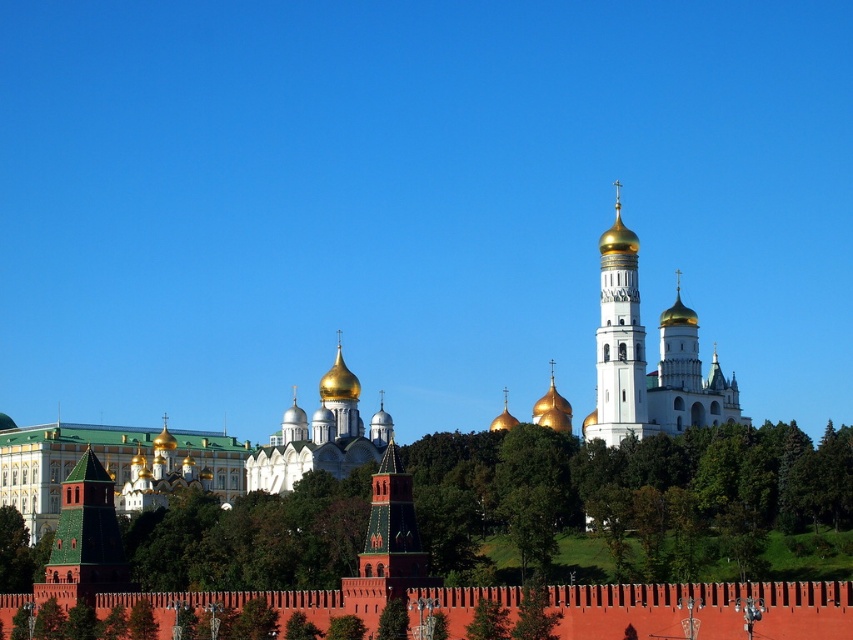
You are standing at the center of the Kremlin and want to take a photo of the green tiled tower at lower left. Which direction should you face to ensure it is in the frame?

You should face towards the lower left direction to capture the green tiled tower at lower left in your photo since it is located at point (x=85, y=538), which is towards the lower left of the scene.